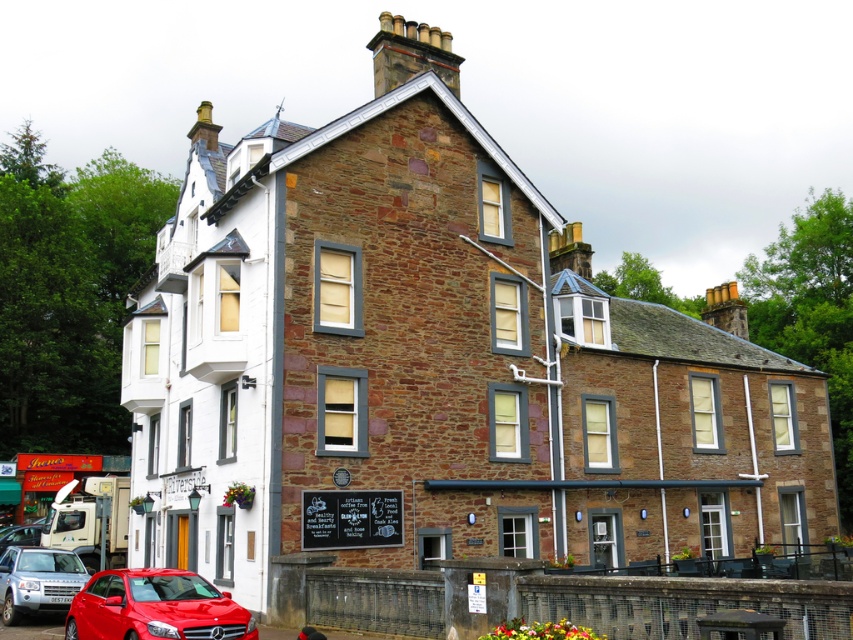
Question: Does shiny red car at lower left lie behind metallic red car at lower left?

Choices:
 (A) yes
 (B) no

Answer: (B)

Question: Can you confirm if shiny red car at lower left is positioned below metallic red car at lower left?

Choices:
 (A) no
 (B) yes

Answer: (A)

Question: From the image, what is the correct spatial relationship of shiny red car at lower left in relation to metallic red car at lower left?

Choices:
 (A) below
 (B) above

Answer: (B)

Question: Which object is closer to the camera taking this photo?

Choices:
 (A) metallic red car at lower left
 (B) shiny red car at lower left

Answer: (B)